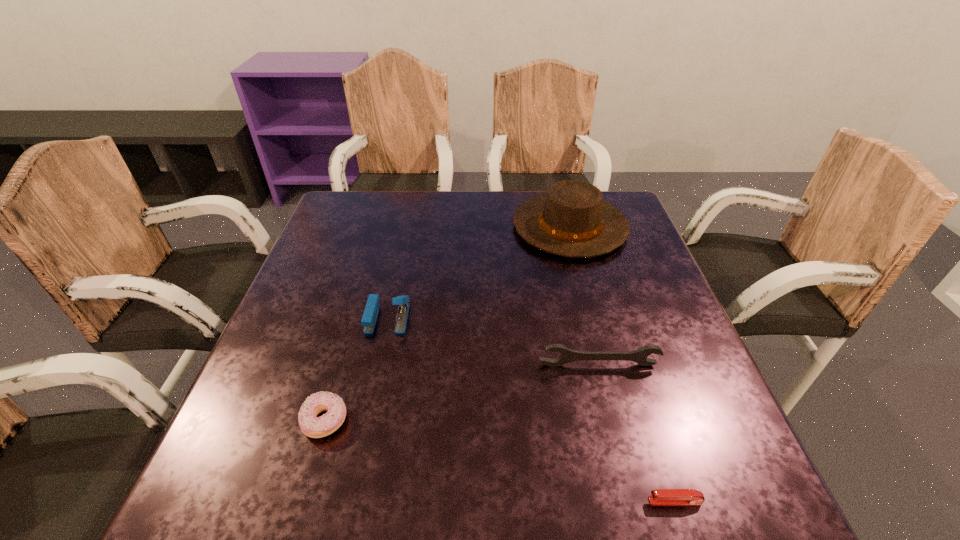
I want to click on free region at the near right corner of the desktop, so (673, 509).

What are the coordinates of `free space between the nearer stapler and the second nearest object` in the screenshot? It's located at (500, 461).

The height and width of the screenshot is (540, 960). Identify the location of free spot between the doughnut and the tallest object. (447, 323).

Locate an element on the screen. free space between the fourth farthest object and the shorter stapler is located at coordinates (500, 461).

Where is `vacant point located between the third nearest object and the doughnut`? This screenshot has height=540, width=960. vacant point located between the third nearest object and the doughnut is located at coordinates (462, 393).

Image resolution: width=960 pixels, height=540 pixels. Find the location of `free space between the third shortest object and the nearest object`. free space between the third shortest object and the nearest object is located at coordinates (636, 433).

At what (x,y) coordinates should I click in order to perform the action: click on unoccupied area between the tallest object and the second nearest object. Please return your answer as a coordinate pair (x, y). The width and height of the screenshot is (960, 540). Looking at the image, I should click on (447, 323).

Image resolution: width=960 pixels, height=540 pixels. I want to click on vacant space that's between the third nearest object and the tallest object, so [585, 296].

The height and width of the screenshot is (540, 960). I want to click on empty location between the wrench and the second tallest object, so click(493, 341).

You are a GUI agent. You are given a task and a screenshot of the screen. Output one action in this format:
    pyautogui.click(x=<x>, y=<y>)
    Task: Click on the unoccupied position between the third shortest object and the shortest object
    
    Given the screenshot: What is the action you would take?
    pyautogui.click(x=636, y=433)